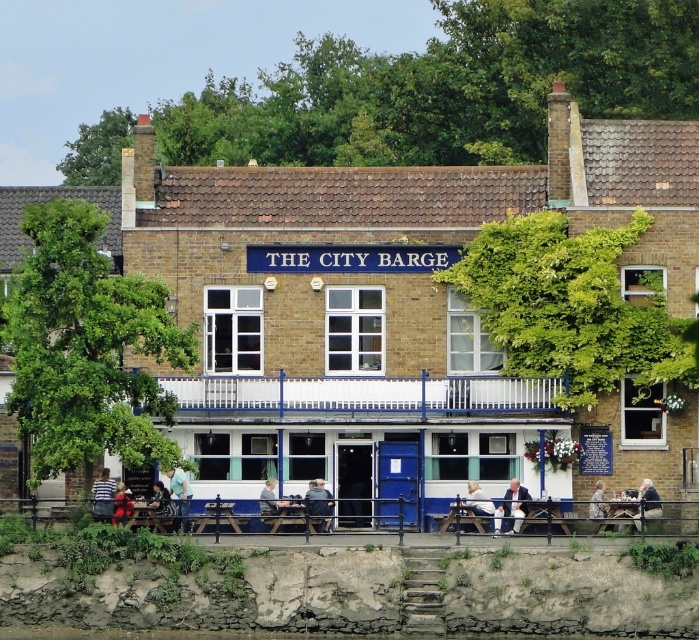
Which of these two, light blue shirt at lower center or wooden table at lower center, stands taller?

Standing taller between the two is light blue shirt at lower center.

Which is more to the left, light blue shirt at lower center or wooden table at lower center?

From the viewer's perspective, light blue shirt at lower center appears more on the left side.

Who is more forward, (182, 513) or (626, 522)?

Point (626, 522) is in front.

This screenshot has height=640, width=699. Identify the location of light blue shirt at lower center. (180, 497).

Is rough stone wall at lower left above light brown wooden bench at lower center?

No, rough stone wall at lower left is not above light brown wooden bench at lower center.

Locate an element on the screen. rough stone wall at lower left is located at coordinates (361, 593).

Which is in front, point (619, 522) or point (635, 509)?

Positioned in front is point (619, 522).

Identify the location of wooden table at lower center. The height and width of the screenshot is (640, 699). (619, 515).